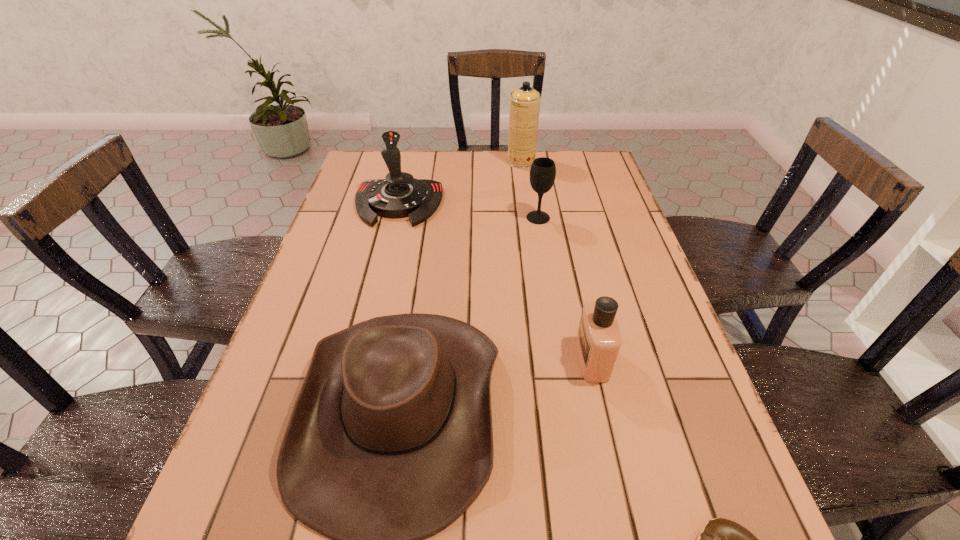
What are the coordinates of `the tallest object` in the screenshot? It's located at (525, 101).

You are a GUI agent. You are given a task and a screenshot of the screen. Output one action in this format:
    pyautogui.click(x=<x>, y=<y>)
    Task: Click on the farthest object
    The image size is (960, 540).
    Given the screenshot: What is the action you would take?
    pyautogui.click(x=525, y=101)

The height and width of the screenshot is (540, 960). What are the coordinates of `joystick` in the screenshot? It's located at (399, 195).

This screenshot has height=540, width=960. Identify the location of wineglass. (543, 170).

Where is `perfume`? This screenshot has height=540, width=960. perfume is located at coordinates (598, 341).

Where is `vacant space situated on the front of the tallest object`? The image size is (960, 540). vacant space situated on the front of the tallest object is located at coordinates (527, 204).

Locate an element on the screen. Image resolution: width=960 pixels, height=540 pixels. blank space located 0.330m on the handle side of the joystick is located at coordinates (372, 315).

Identify the location of vacant space located on the back of the wineglass. The height and width of the screenshot is (540, 960). (532, 181).

Where is `vacant area situated 0.140m on the front label of the perfume`? vacant area situated 0.140m on the front label of the perfume is located at coordinates (511, 359).

Where is `vacant space located 0.130m on the front label of the perfume`? Image resolution: width=960 pixels, height=540 pixels. vacant space located 0.130m on the front label of the perfume is located at coordinates (516, 359).